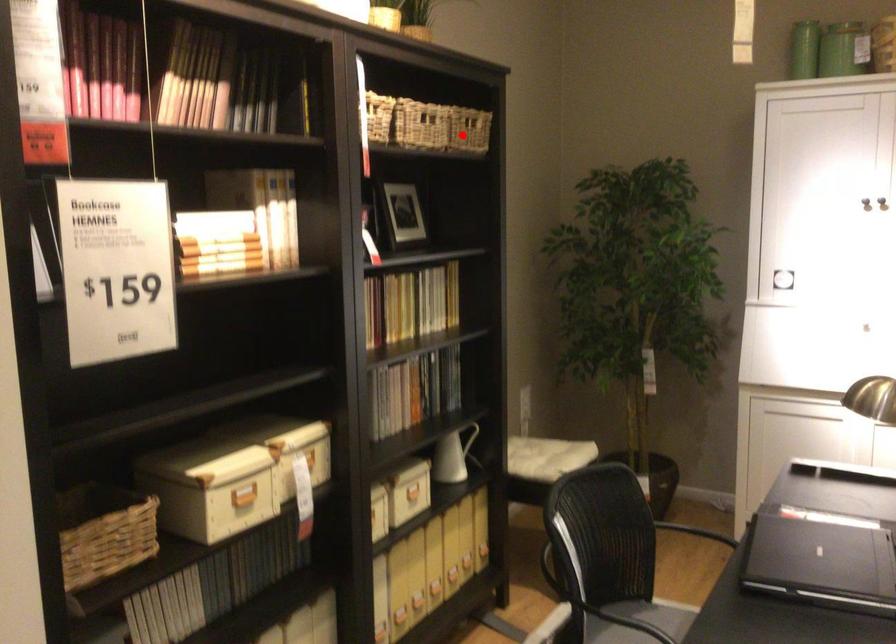
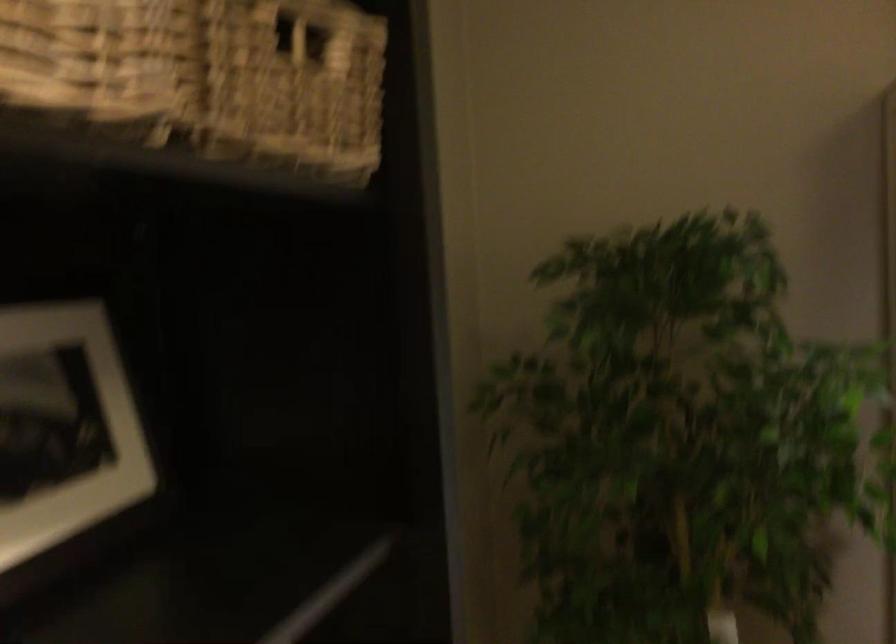
Locate, in the second image, the point that corresponds to the highlighted location in the first image.

(291, 91)